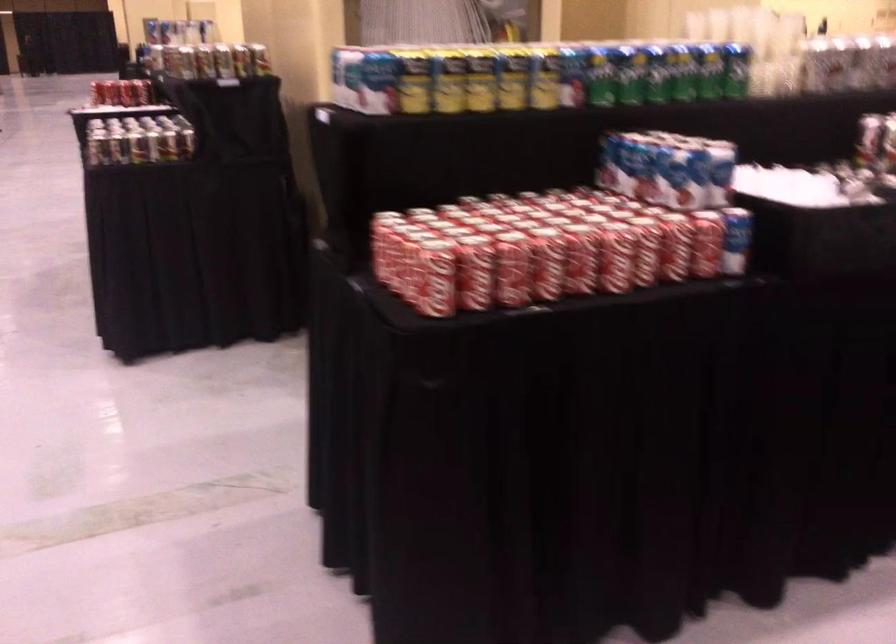
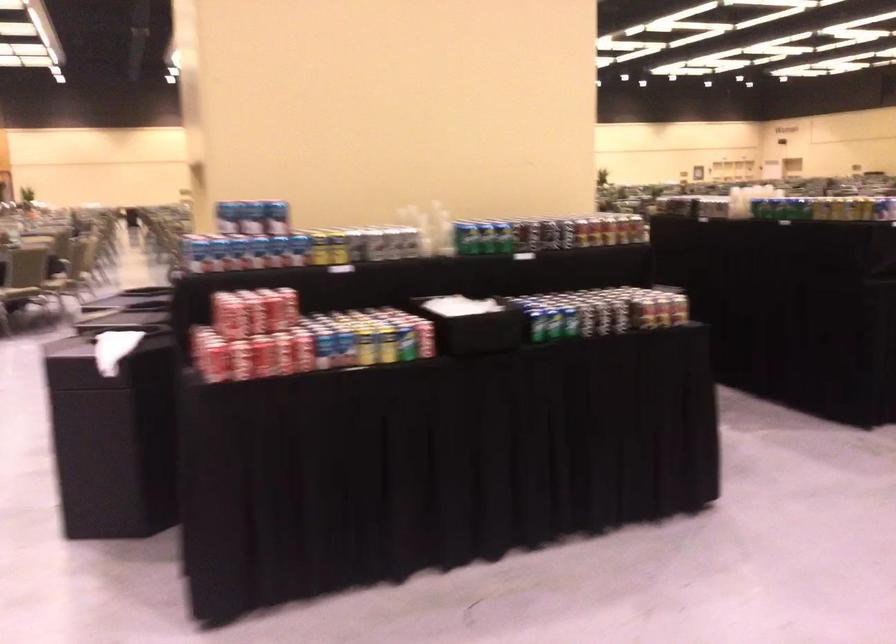
Where in the second image is the point corresponding to (x=116, y=93) from the first image?

(386, 345)